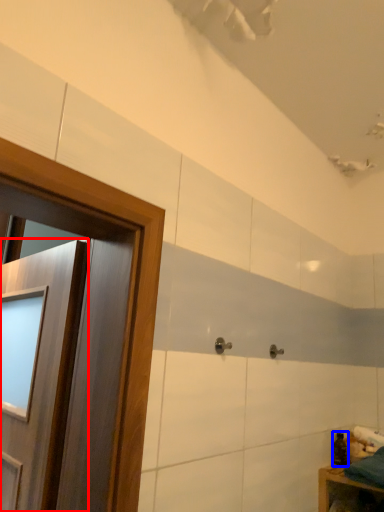
Question: Which object appears farthest to the camera in this image, door (highlighted by a red box) or toiletry (highlighted by a blue box)?

Choices:
 (A) door
 (B) toiletry

Answer: (B)